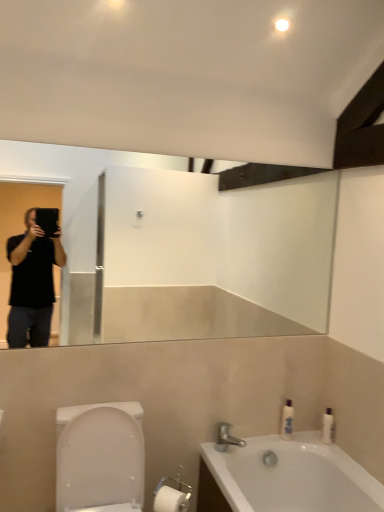
This screenshot has width=384, height=512. What do you see at coordinates (328, 426) in the screenshot? I see `white glossy bottle at right, the 1th toiletry when ordered from right to left` at bounding box center [328, 426].

Identify the location of white glossy toilet at lower left. The height and width of the screenshot is (512, 384). (100, 459).

Considering the sizes of white glossy bottle at right, which is counted as the first toiletry, starting from the left, and white glossy bathtub at lower right in the image, is white glossy bottle at right, which is counted as the first toiletry, starting from the left, bigger or smaller than white glossy bathtub at lower right?

Considering their sizes, white glossy bottle at right, which is counted as the first toiletry, starting from the left, takes up less space than white glossy bathtub at lower right.

Can you confirm if white glossy bottle at right, which is counted as the first toiletry, starting from the left, is wider than white glossy bathtub at lower right?

In fact, white glossy bottle at right, which is counted as the first toiletry, starting from the left, might be narrower than white glossy bathtub at lower right.

Is white glossy bottle at right, arranged as the 2th toiletry when viewed from the right, touching white glossy bathtub at lower right?

They are not placed beside each other.

From the picture: Which object is wider, white glossy bottle at right, arranged as the 2th toiletry when viewed from the right, or white glossy bottle at right, arranged as the second toiletry when viewed from the left?

With larger width is white glossy bottle at right, arranged as the 2th toiletry when viewed from the right.

Is point (289, 417) in front of point (324, 432)?

No, (289, 417) is behind (324, 432).

How distant is white glossy bottle at right, arranged as the 2th toiletry when viewed from the right, from white glossy bottle at right, arranged as the second toiletry when viewed from the left?

7.64 inches.

Would you say white glossy bottle at right, which is counted as the first toiletry, starting from the left, is outside white glossy bottle at right, the 1th toiletry when ordered from right to left?

Indeed, white glossy bottle at right, which is counted as the first toiletry, starting from the left, is completely outside white glossy bottle at right, the 1th toiletry when ordered from right to left.

Is white glossy bathtub at lower right wider than silver metallic faucet at lower center?

Indeed, white glossy bathtub at lower right has a greater width compared to silver metallic faucet at lower center.

Which of these two, white glossy bathtub at lower right or silver metallic faucet at lower center, stands shorter?

silver metallic faucet at lower center.

From a real-world perspective, does white glossy bathtub at lower right stand above silver metallic faucet at lower center?

Actually, white glossy bathtub at lower right is physically below silver metallic faucet at lower center in the real world.

Who is smaller, white glossy bathtub at lower right or silver metallic faucet at lower center?

Smaller between the two is silver metallic faucet at lower center.

Can you tell me how much white glossy toilet at lower left and silver metallic faucet at lower center differ in facing direction?

The angular difference between white glossy toilet at lower left and silver metallic faucet at lower center is 0.0361 degrees.

Is white glossy toilet at lower left bigger or smaller than silver metallic faucet at lower center?

Considering their sizes, white glossy toilet at lower left takes up more space than silver metallic faucet at lower center.

Looking at this image, considering the sizes of objects white glossy toilet at lower left and silver metallic faucet at lower center in the image provided, who is wider, white glossy toilet at lower left or silver metallic faucet at lower center?

Wider between the two is white glossy toilet at lower left.

Locate an element on the screen. This screenshot has height=512, width=384. toilet on the left of silver metallic faucet at lower center is located at coordinates (100, 459).

Which object is thinner, white glossy bathtub at lower right or white glossy bottle at right, the 1th toiletry when ordered from right to left?

With smaller width is white glossy bottle at right, the 1th toiletry when ordered from right to left.

From a real-world perspective, is white glossy bathtub at lower right over white glossy bottle at right, arranged as the second toiletry when viewed from the left?

No, from a real-world perspective, white glossy bathtub at lower right is not on top of white glossy bottle at right, arranged as the second toiletry when viewed from the left.

Is white glossy bathtub at lower right wider or thinner than white glossy toilet at lower left?

In the image, white glossy bathtub at lower right appears to be wider than white glossy toilet at lower left.

Is white glossy bathtub at lower right touching white glossy toilet at lower left?

white glossy bathtub at lower right and white glossy toilet at lower left are clearly separated.

Where is `toilet positioned vertically above the white glossy bathtub at lower right (from a real-world perspective)`? toilet positioned vertically above the white glossy bathtub at lower right (from a real-world perspective) is located at coordinates (100, 459).

Can you confirm if white glossy bathtub at lower right is smaller than white glossy toilet at lower left?

Actually, white glossy bathtub at lower right might be larger than white glossy toilet at lower left.

Considering the relative sizes of white glossy toilet at lower left and white glossy bathtub at lower right in the image provided, is white glossy toilet at lower left shorter than white glossy bathtub at lower right?

Incorrect, the height of white glossy toilet at lower left does not fall short of that of white glossy bathtub at lower right.

Identify the location of bathtub directly beneath the white glossy toilet at lower left (from a real-world perspective). This screenshot has width=384, height=512. (285, 478).

From the image's perspective, which one is positioned lower, white glossy toilet at lower left or white glossy bathtub at lower right?

white glossy bathtub at lower right is shown below in the image.

Is there a large distance between white glossy toilet at lower left and white glossy bathtub at lower right?

They are positioned close to each other.

The width and height of the screenshot is (384, 512). In order to click on bathtub below the white glossy bottle at right, which is counted as the first toiletry, starting from the left (from a real-world perspective) in this screenshot , I will do `click(285, 478)`.

Where is `toiletry on the right side of white glossy bottle at right, arranged as the 2th toiletry when viewed from the right`? toiletry on the right side of white glossy bottle at right, arranged as the 2th toiletry when viewed from the right is located at coordinates (328, 426).

Based on their spatial positions, is silver metallic faucet at lower center or white glossy bathtub at lower right further from white glossy toilet at lower left?

white glossy bathtub at lower right lies further to white glossy toilet at lower left than the other object.

Estimate the real-world distances between objects in this image. Which object is further from white glossy bottle at right, arranged as the second toiletry when viewed from the left, white glossy toilet at lower left or silver metallic faucet at lower center?

white glossy toilet at lower left is positioned further to the anchor white glossy bottle at right, arranged as the second toiletry when viewed from the left.

From the image, which object appears to be nearer to silver metallic faucet at lower center, white glossy toilet at lower left or white glossy bottle at right, arranged as the 2th toiletry when viewed from the right?

white glossy bottle at right, arranged as the 2th toiletry when viewed from the right, lies closer to silver metallic faucet at lower center than the other object.

From the picture: Which object lies nearer to the anchor point white glossy bottle at right, arranged as the second toiletry when viewed from the left, white glossy bottle at right, arranged as the 2th toiletry when viewed from the right, or silver metallic faucet at lower center?

white glossy bottle at right, arranged as the 2th toiletry when viewed from the right, lies closer to white glossy bottle at right, arranged as the second toiletry when viewed from the left, than the other object.

Estimate the real-world distances between objects in this image. Which object is closer to white glossy bathtub at lower right, white glossy bottle at right, arranged as the second toiletry when viewed from the left, or white glossy bottle at right, which is counted as the first toiletry, starting from the left?

Among the two, white glossy bottle at right, which is counted as the first toiletry, starting from the left, is located nearer to white glossy bathtub at lower right.

Looking at the image, which one is located closer to white glossy toilet at lower left, white glossy bottle at right, which is counted as the first toiletry, starting from the left, or white glossy bathtub at lower right?

white glossy bathtub at lower right lies closer to white glossy toilet at lower left than the other object.

Looking at the image, which one is located further to white glossy bottle at right, arranged as the 2th toiletry when viewed from the right, white glossy toilet at lower left or silver metallic faucet at lower center?

white glossy toilet at lower left lies further to white glossy bottle at right, arranged as the 2th toiletry when viewed from the right, than the other object.

Considering their positions, is white glossy toilet at lower left positioned further to white glossy bathtub at lower right than white glossy bottle at right, the 1th toiletry when ordered from right to left?

white glossy toilet at lower left lies further to white glossy bathtub at lower right than the other object.

Identify the location of tap between white glossy toilet at lower left and white glossy bottle at right, arranged as the 2th toiletry when viewed from the right, in the front-back direction. (227, 438).

Locate an element on the screen. The width and height of the screenshot is (384, 512). tap between white glossy bathtub at lower right and white glossy bottle at right, arranged as the second toiletry when viewed from the left, from front to back is located at coordinates (227, 438).

You are a GUI agent. You are given a task and a screenshot of the screen. Output one action in this format:
    pyautogui.click(x=<x>, y=<y>)
    Task: Click on the toiletry between silver metallic faucet at lower center and white glossy bottle at right, the 1th toiletry when ordered from right to left, from left to right
    The width and height of the screenshot is (384, 512).
    Given the screenshot: What is the action you would take?
    pyautogui.click(x=287, y=420)

You are a GUI agent. You are given a task and a screenshot of the screen. Output one action in this format:
    pyautogui.click(x=<x>, y=<y>)
    Task: Click on the tap situated between white glossy toilet at lower left and white glossy bottle at right, arranged as the second toiletry when viewed from the left, from left to right
    
    Given the screenshot: What is the action you would take?
    pyautogui.click(x=227, y=438)